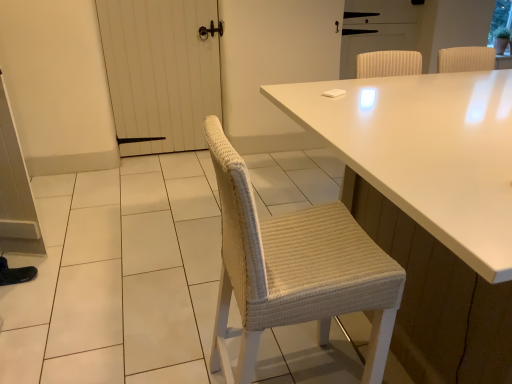
Question: Is white glossy table at center taller than white wooden door at left, arranged as the 2th screen door when viewed from the right?

Choices:
 (A) no
 (B) yes

Answer: (A)

Question: Is white glossy table at center oriented away from white wooden door at left, arranged as the 2th screen door when viewed from the right?

Choices:
 (A) no
 (B) yes

Answer: (A)

Question: Considering the relative sizes of white glossy table at center and white wooden door at left, arranged as the 2th screen door when viewed from the right, in the image provided, is white glossy table at center smaller than white wooden door at left, arranged as the 2th screen door when viewed from the right,?

Choices:
 (A) no
 (B) yes

Answer: (A)

Question: From a real-world perspective, is white glossy table at center below white wooden door at left, the first screen door in the left-to-right sequence?

Choices:
 (A) no
 (B) yes

Answer: (B)

Question: Is white glossy table at center facing towards white wooden door at left, arranged as the 2th screen door when viewed from the right?

Choices:
 (A) yes
 (B) no

Answer: (A)

Question: Is white glossy table at center far from white wooden door at left, arranged as the 2th screen door when viewed from the right?

Choices:
 (A) yes
 (B) no

Answer: (A)

Question: Is white ribbed screen door at upper center, the 2th screen door positioned from the left, further to camera compared to white wooden door at left, the first screen door in the left-to-right sequence?

Choices:
 (A) yes
 (B) no

Answer: (A)

Question: Does white ribbed screen door at upper center, the 2th screen door positioned from the left, lie in front of white wooden door at left, arranged as the 2th screen door when viewed from the right?

Choices:
 (A) yes
 (B) no

Answer: (B)

Question: Does white ribbed screen door at upper center, acting as the 1th screen door starting from the right, have a greater width compared to white wooden door at left, the first screen door in the left-to-right sequence?

Choices:
 (A) no
 (B) yes

Answer: (A)

Question: Does white ribbed screen door at upper center, the 2th screen door positioned from the left, touch white wooden door at left, the first screen door in the left-to-right sequence?

Choices:
 (A) no
 (B) yes

Answer: (A)

Question: Is white ribbed screen door at upper center, acting as the 1th screen door starting from the right, to the left of white wooden door at left, the first screen door in the left-to-right sequence, from the viewer's perspective?

Choices:
 (A) no
 (B) yes

Answer: (A)

Question: From the image's perspective, is white ribbed screen door at upper center, the 2th screen door positioned from the left, located above white wooden door at left, arranged as the 2th screen door when viewed from the right?

Choices:
 (A) no
 (B) yes

Answer: (B)

Question: Can you confirm if white wooden door at left, arranged as the 2th screen door when viewed from the right, is taller than white glossy table at center?

Choices:
 (A) yes
 (B) no

Answer: (A)